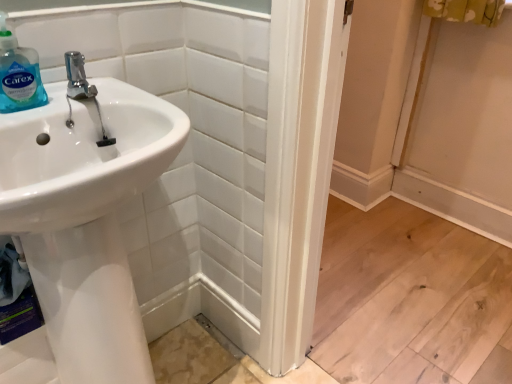
Question: Is white glossy sink at left bigger than translucent plastic soap dispenser at upper left?

Choices:
 (A) yes
 (B) no

Answer: (A)

Question: Is white glossy sink at left in front of translucent plastic soap dispenser at upper left?

Choices:
 (A) yes
 (B) no

Answer: (B)

Question: Does white glossy sink at left appear on the left side of translucent plastic soap dispenser at upper left?

Choices:
 (A) yes
 (B) no

Answer: (B)

Question: From a real-world perspective, is white glossy sink at left on translucent plastic soap dispenser at upper left?

Choices:
 (A) yes
 (B) no

Answer: (B)

Question: Is white glossy sink at left facing towards translucent plastic soap dispenser at upper left?

Choices:
 (A) yes
 (B) no

Answer: (A)

Question: From the image's perspective, does white glossy sink at left appear lower than translucent plastic soap dispenser at upper left?

Choices:
 (A) no
 (B) yes

Answer: (B)

Question: Is white glossy sink at left at the back of translucent plastic soap dispenser at upper left?

Choices:
 (A) no
 (B) yes

Answer: (B)

Question: Is translucent plastic soap dispenser at upper left completely or partially outside of white glossy sink at left?

Choices:
 (A) no
 (B) yes

Answer: (B)

Question: Is translucent plastic soap dispenser at upper left smaller than white glossy sink at left?

Choices:
 (A) no
 (B) yes

Answer: (B)

Question: Does translucent plastic soap dispenser at upper left have a lesser width compared to white glossy sink at left?

Choices:
 (A) no
 (B) yes

Answer: (A)

Question: From a real-world perspective, is translucent plastic soap dispenser at upper left physically above white glossy sink at left?

Choices:
 (A) no
 (B) yes

Answer: (B)

Question: Considering the relative positions of translucent plastic soap dispenser at upper left and white glossy sink at left in the image provided, is translucent plastic soap dispenser at upper left in front of white glossy sink at left?

Choices:
 (A) yes
 (B) no

Answer: (A)

Question: From the image's perspective, is polished chrome faucet at upper left on top of white glossy sink at left?

Choices:
 (A) yes
 (B) no

Answer: (A)